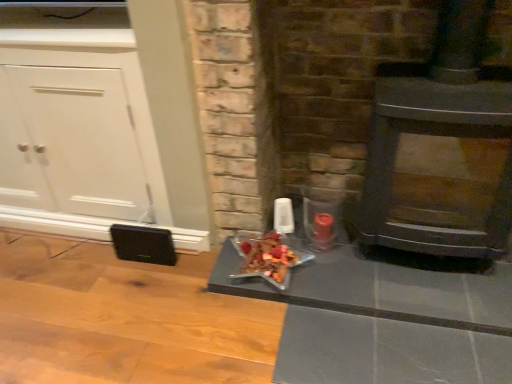
Question: From the image's perspective, is wooden panel stove at right below shiny glass tray at center?

Choices:
 (A) no
 (B) yes

Answer: (A)

Question: Is wooden panel stove at right not close to shiny glass tray at center?

Choices:
 (A) no
 (B) yes

Answer: (A)

Question: Considering the relative positions of wooden panel stove at right and shiny glass tray at center in the image provided, is wooden panel stove at right to the right of shiny glass tray at center from the viewer's perspective?

Choices:
 (A) no
 (B) yes

Answer: (B)

Question: Can you confirm if wooden panel stove at right is smaller than shiny glass tray at center?

Choices:
 (A) yes
 (B) no

Answer: (B)

Question: Is shiny glass tray at center inside wooden panel stove at right?

Choices:
 (A) yes
 (B) no

Answer: (B)

Question: Is wooden panel stove at right positioned behind shiny glass tray at center?

Choices:
 (A) yes
 (B) no

Answer: (B)

Question: From the image's perspective, is matte black fireplace at center on wooden panel stove at right?

Choices:
 (A) yes
 (B) no

Answer: (B)

Question: Is matte black fireplace at center positioned before wooden panel stove at right?

Choices:
 (A) yes
 (B) no

Answer: (A)

Question: From a real-world perspective, is matte black fireplace at center on top of wooden panel stove at right?

Choices:
 (A) no
 (B) yes

Answer: (A)

Question: Is matte black fireplace at center facing away from wooden panel stove at right?

Choices:
 (A) yes
 (B) no

Answer: (A)

Question: Is matte black fireplace at center with wooden panel stove at right?

Choices:
 (A) yes
 (B) no

Answer: (B)

Question: Does matte black fireplace at center turn towards wooden panel stove at right?

Choices:
 (A) no
 (B) yes

Answer: (B)

Question: Is matte black fireplace at center thinner than shiny metallic star at center?

Choices:
 (A) yes
 (B) no

Answer: (B)